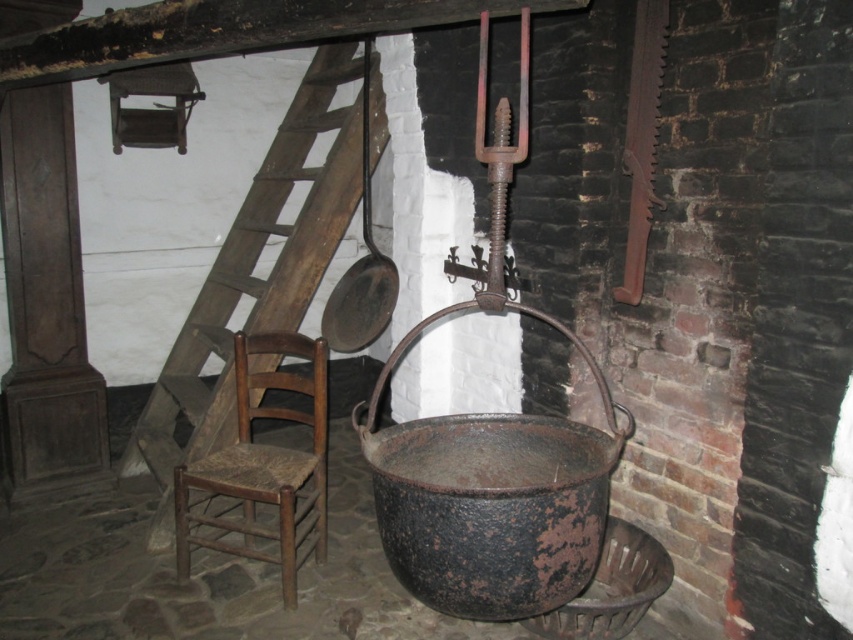
You are a painter needing to reach a high shelf in this rustic kitchen. You see a wooden ladder at center and a wooden woven seat chair at left. Which object can you use to safely reach the high shelf?

The wooden ladder at center has a larger size compared to the wooden woven seat chair at left, so the wooden ladder at center is more suitable for safely reaching the high shelf.

You are an interior designer assessing the space for a new shelf. The dark brown wooden beam at upper center and the wooden woven seat chair at left are in your way. Which object is shorter and thus easier to position the shelf around?

The dark brown wooden beam at upper center is shorter than the wooden woven seat chair at left, so it would be easier to position the shelf around the beam.

You are standing in the rustic kitchen and need to reach the large, dark, rusted cauldron hanging on the brick wall. The wooden ladder at center is your only tool. Can you use the ladder to safely reach the cauldron?

The wooden ladder at center is located at point (x=256, y=276), which is close enough to the cauldron to allow safe access. Yes, you can use the ladder to reach the cauldon safely.